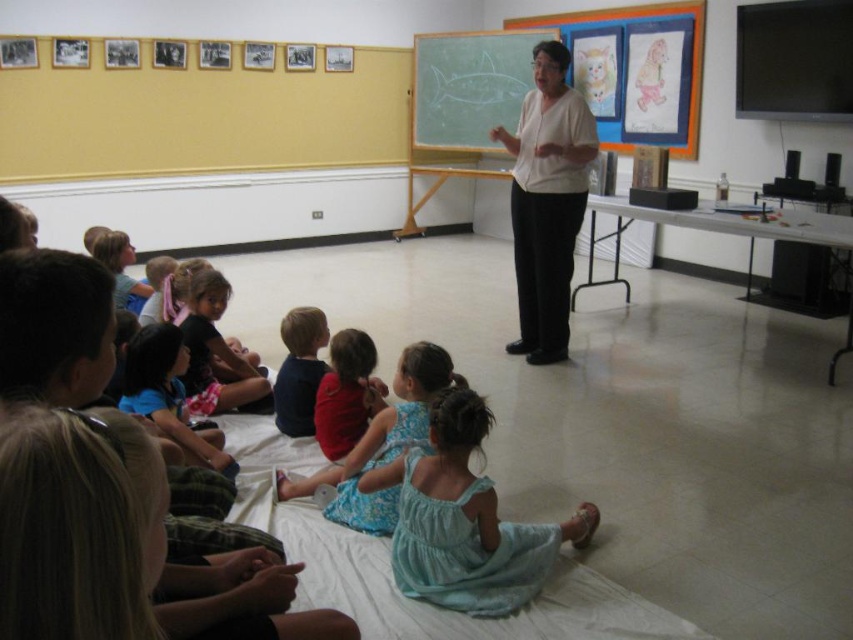
You are a student sitting at the point labeled as point (547, 202) in the classroom. Looking around, you see the framed photographs on the left wall and the chalkboard with a fish drawing on the right. Which direction should you turn to face the framed photographs?

The point (547, 202) corresponds to the white matte shirt at upper center. Since the framed photographs are on the left wall and you are facing the teacher, you should turn to your left to face the framed photographs.

You are a photographer taking a picture of the classroom scene. The white matte shirt at upper center and the dark blue shirt at center are both visible in your frame. Which shirt should you focus on if you want to capture the larger one in the photo?

The white matte shirt at upper center is bigger than the dark blue shirt at center, so you should focus on the white matte shirt at upper center to capture the larger one in the photo.